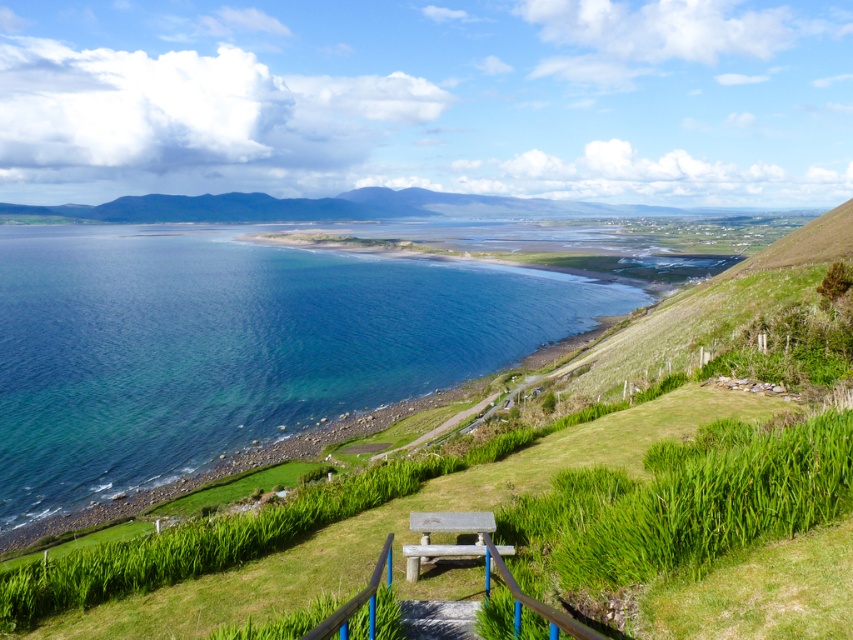
You are standing at the top of the grassy slope in the coastal landscape scene. You want to walk directly to the clear blue water at lower left. How far will you have to walk in feet?

The clear blue water at lower left is 131.75 feet away from the viewer, so you will have to walk 131.75 feet to reach it.

You are a visitor at the coastal landscape and want to sit on the wooden park bench at center. However, you need to avoid stepping into the clear blue water at lower left. Based on the scene description, can you safely reach the bench without getting your feet wet?

The clear blue water at lower left is located above the wooden park bench at center, meaning the water is higher in elevation than the bench. Since the bench is lower, you can safely walk to it without stepping into the water.